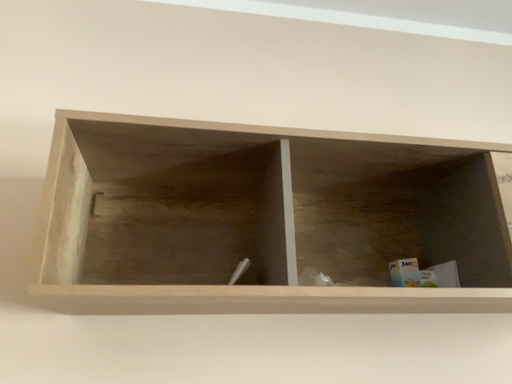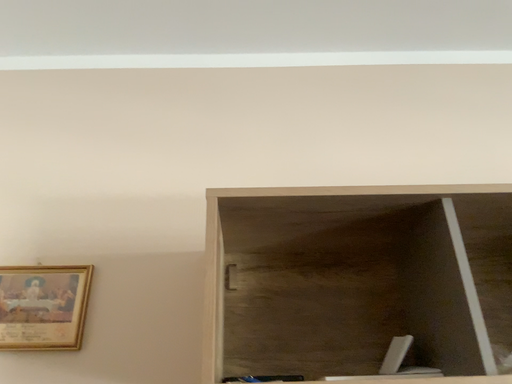
Question: Which way did the camera rotate in the video?

Choices:
 (A) rotated right
 (B) rotated left

Answer: (B)